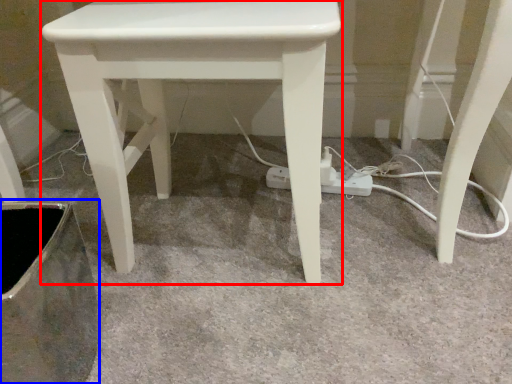
Question: Which object is further to the camera taking this photo, stool (highlighted by a red box) or swivel chair (highlighted by a blue box)?

Choices:
 (A) stool
 (B) swivel chair

Answer: (A)